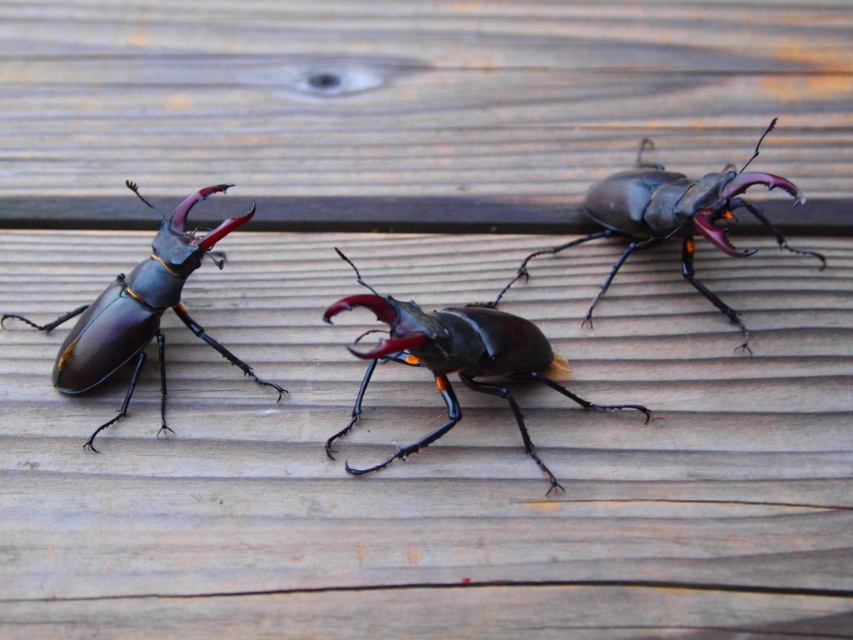
Question: From the image, what is the correct spatial relationship of shiny dark brown beetle at center in relation to shiny brown beetle at center?

Choices:
 (A) left
 (B) right

Answer: (A)

Question: Is shiny dark brown beetle at center to the left of glossy black beetle at left from the viewer's perspective?

Choices:
 (A) yes
 (B) no

Answer: (B)

Question: Which point is farther to the camera?

Choices:
 (A) click(x=96, y=384)
 (B) click(x=524, y=273)
 (C) click(x=526, y=438)

Answer: (B)

Question: Which point is farther from the camera taking this photo?

Choices:
 (A) (492, 365)
 (B) (651, 173)
 (C) (96, 330)

Answer: (B)

Question: Which of the following is the farthest from the observer?

Choices:
 (A) (114, 342)
 (B) (463, 321)
 (C) (627, 230)

Answer: (C)

Question: Does shiny dark brown beetle at center appear on the left side of glossy black beetle at left?

Choices:
 (A) yes
 (B) no

Answer: (B)